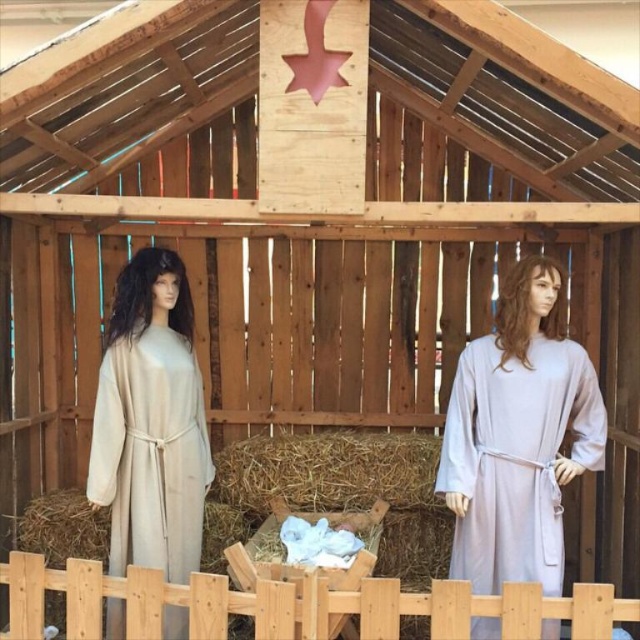
Question: Can you confirm if beige fabric dress at left is positioned to the left of light purple fabric dress at right?

Choices:
 (A) yes
 (B) no

Answer: (A)

Question: Does beige fabric dress at left appear over light purple fabric dress at right?

Choices:
 (A) yes
 (B) no

Answer: (A)

Question: Which of these objects is positioned farthest from the wooden fence at lower center?

Choices:
 (A) beige fabric dress at left
 (B) light purple fabric dress at right

Answer: (B)

Question: Is light purple fabric dress at right smaller than wooden fence at lower center?

Choices:
 (A) no
 (B) yes

Answer: (B)

Question: Which of the following is the closest to the observer?

Choices:
 (A) (156, 512)
 (B) (365, 579)

Answer: (B)

Question: Based on their relative distances, which object is nearer to the beige fabric dress at left?

Choices:
 (A) light purple fabric dress at right
 (B) wooden fence at lower center

Answer: (B)